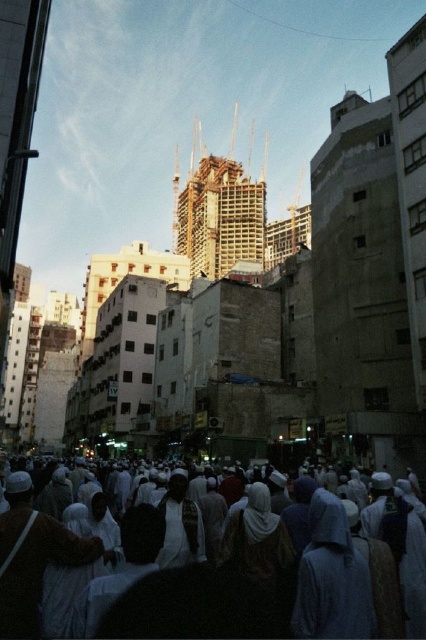
Consider the image. You are a photographer standing at the edge of the scene. You want to capture both the white clothed crowd at center and the light brown fabric robe at lower left in the same frame. Given that your camera has a maximum zoom range of 10 meters, will you be able to include both subjects in the photo?

The distance between the white clothed crowd at center and the light brown fabric robe at lower left is 10.71 meters. Since your camera can only zoom up to 10 meters, you won

You are a photographer trying to capture the cultural diversity of the crowd. You notice a light brown fabric robe at lower left and a white matte robe at center. Which robe would you need to zoom in on less to capture its details, considering their sizes?

The light brown fabric robe at lower left is wider than the white matte robe at center, so you would need to zoom in less on the light brown fabric robe at lower left to capture its details since it is larger in size.